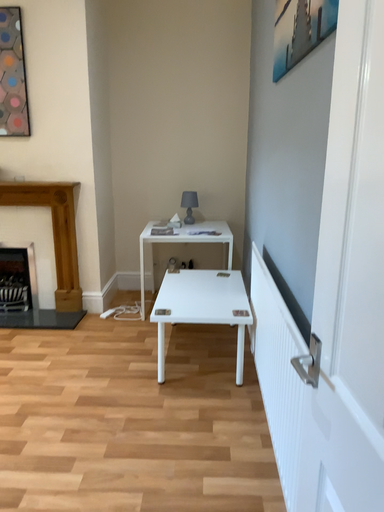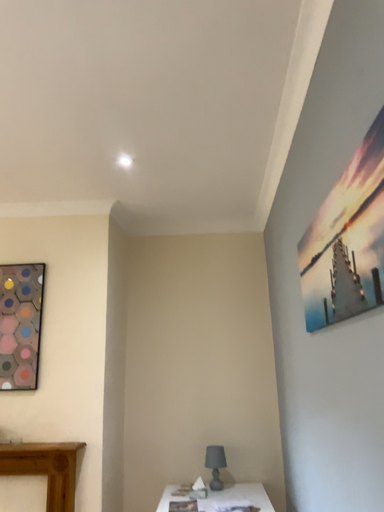
Question: Which way did the camera rotate in the video?

Choices:
 (A) rotated downward
 (B) rotated upward

Answer: (B)